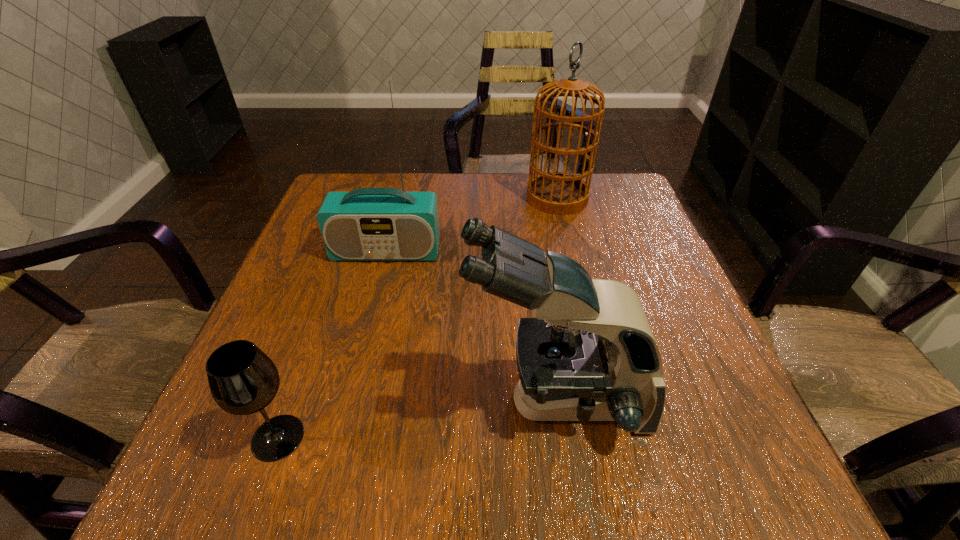
Where is `object that is at the far edge`? The image size is (960, 540). object that is at the far edge is located at coordinates (561, 193).

Locate an element on the screen. The image size is (960, 540). microscope that is at the near edge is located at coordinates (589, 355).

Identify the location of wineglass that is at the near edge. (243, 380).

I want to click on radio receiver situated at the left edge, so click(x=366, y=224).

Locate an element on the screen. wineglass that is at the left edge is located at coordinates (243, 380).

Where is `birdcage that is at the right edge`? The image size is (960, 540). birdcage that is at the right edge is located at coordinates (561, 193).

The height and width of the screenshot is (540, 960). I want to click on microscope positioned at the right edge, so tap(589, 355).

At what (x,y) coordinates should I click in order to perform the action: click on object located at the near left corner. Please return your answer as a coordinate pair (x, y). This screenshot has height=540, width=960. Looking at the image, I should click on (243, 380).

Where is `object that is at the far right corner`? object that is at the far right corner is located at coordinates (561, 193).

I want to click on object located at the near right corner, so click(x=589, y=355).